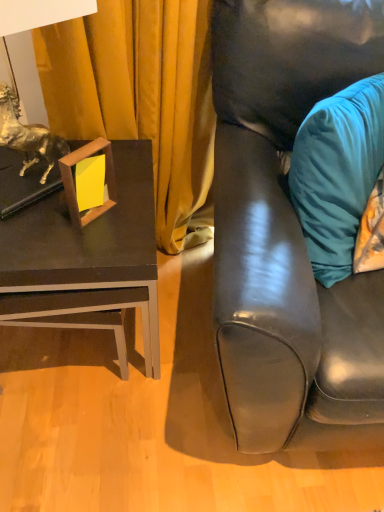
Identify the location of vacant space situated on the left part of woodenobject at left. The height and width of the screenshot is (512, 384). (37, 220).